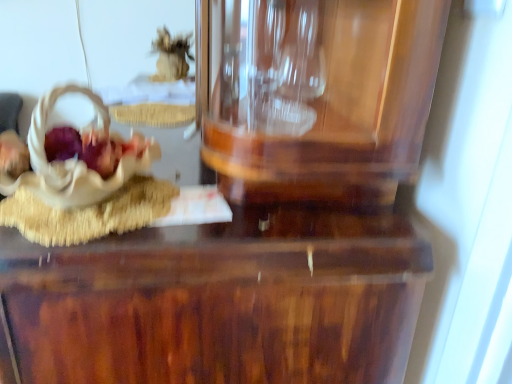
Find the location of a particular element. This screenshot has height=384, width=512. glossy wood table at center is located at coordinates (217, 302).

Describe the element at coordinates (170, 56) in the screenshot. I see `fuzzy brown object at upper center, the second stuff viewed from the front` at that location.

Find the location of a particular element. This screenshot has width=512, height=384. glossy wood table at center is located at coordinates (217, 302).

Looking at this image, can fuzzy brown object at upper center, the first stuff positioned from the back, be found inside beige fabric basket at left, the 1th stuff when ordered from bottom to top?

Definitely not — fuzzy brown object at upper center, the first stuff positioned from the back, is not inside beige fabric basket at left, the 1th stuff when ordered from bottom to top.

Can you tell me how much beige fabric basket at left, the 1th stuff positioned from the front, and fuzzy brown object at upper center, the first stuff positioned from the back, differ in facing direction?

1.26 degrees.

Is beige fabric basket at left, the 1th stuff positioned from the front, to the left of fuzzy brown object at upper center, which is the 1th stuff in top-to-bottom order, from the viewer's perspective?

In fact, beige fabric basket at left, the 1th stuff positioned from the front, is to the right of fuzzy brown object at upper center, which is the 1th stuff in top-to-bottom order.

Is beige fabric basket at left, the 1th stuff positioned from the front, beside fuzzy brown object at upper center, the second stuff viewed from the front?

No.

Is matte brown basket at left surrounded by fuzzy brown object at upper center, the first stuff positioned from the back?

No, fuzzy brown object at upper center, the first stuff positioned from the back, does not contain matte brown basket at left.

From a real-world perspective, relative to matte brown basket at left, is fuzzy brown object at upper center, which is the 1th stuff in top-to-bottom order, vertically above or below?

fuzzy brown object at upper center, which is the 1th stuff in top-to-bottom order, is above matte brown basket at left.

Is fuzzy brown object at upper center, which is the 1th stuff in top-to-bottom order, placed right next to matte brown basket at left?

There is a gap between fuzzy brown object at upper center, which is the 1th stuff in top-to-bottom order, and matte brown basket at left.

Looking at this image, is the position of matte brown basket at left less distant than that of glossy wood table at center?

No, matte brown basket at left is further to the viewer.

From a real-world perspective, is matte brown basket at left on top of glossy wood table at center?

Yes.

Between matte brown basket at left and glossy wood table at center, which one has more height?

Standing taller between the two is glossy wood table at center.

Between point (173, 68) and point (42, 109), which one is positioned behind?

Point (42, 109)

Which is correct: fuzzy brown object at upper center, which is the 1th stuff in top-to-bottom order, is inside beige fabric basket at left, the 1th stuff when ordered from bottom to top, or outside of it?

fuzzy brown object at upper center, which is the 1th stuff in top-to-bottom order, cannot be found inside beige fabric basket at left, the 1th stuff when ordered from bottom to top.

Which is more to the right, fuzzy brown object at upper center, which is the 2th stuff in bottom-to-top order, or beige fabric basket at left, the 1th stuff when ordered from bottom to top?

Positioned to the right is beige fabric basket at left, the 1th stuff when ordered from bottom to top.

From a real-world perspective, between glossy wood table at center and beige fabric basket at left, marked as the second stuff in a back-to-front arrangement, who is vertically higher?

From a 3D spatial view, beige fabric basket at left, marked as the second stuff in a back-to-front arrangement, is above.

Is glossy wood table at center in front of or behind beige fabric basket at left, the second stuff positioned from the top, in the image?

In the image, glossy wood table at center appears in front of beige fabric basket at left, the second stuff positioned from the top.

From the picture: Does glossy wood table at center turn towards beige fabric basket at left, the 1th stuff when ordered from bottom to top?

No, glossy wood table at center does not turn towards beige fabric basket at left, the 1th stuff when ordered from bottom to top.

Is glossy wood table at center far from beige fabric basket at left, marked as the second stuff in a back-to-front arrangement?

glossy wood table at center is near beige fabric basket at left, marked as the second stuff in a back-to-front arrangement, not far away.

Can you confirm if glossy wood table at center is shorter than matte brown basket at left?

No.

Are glossy wood table at center and matte brown basket at left located far from each other?

Actually, glossy wood table at center and matte brown basket at left are a little close together.

Locate an element on the screen. This screenshot has width=512, height=384. food above the glossy wood table at center (from a real-world perspective) is located at coordinates (89, 213).

Looking at this image, is the depth of glossy wood table at center greater than that of fuzzy brown object at upper center, which is the 1th stuff in top-to-bottom order?

No, it is in front of fuzzy brown object at upper center, which is the 1th stuff in top-to-bottom order.

How many degrees apart are the facing directions of glossy wood table at center and fuzzy brown object at upper center, which is the 2th stuff in bottom-to-top order?

2.51 degrees separate the facing orientations of glossy wood table at center and fuzzy brown object at upper center, which is the 2th stuff in bottom-to-top order.

Is glossy wood table at center not close to fuzzy brown object at upper center, the first stuff positioned from the back?

Yes, glossy wood table at center and fuzzy brown object at upper center, the first stuff positioned from the back, are located far from each other.

Identify the location of table lying on the right of fuzzy brown object at upper center, which is the 2th stuff in bottom-to-top order. This screenshot has height=384, width=512. (217, 302).

The image size is (512, 384). Find the location of `stuff that is above the beige fabric basket at left, the 1th stuff when ordered from bottom to top (from the image's perspective)`. stuff that is above the beige fabric basket at left, the 1th stuff when ordered from bottom to top (from the image's perspective) is located at coordinates (170, 56).

The height and width of the screenshot is (384, 512). Find the location of `food on the right of fuzzy brown object at upper center, which is the 1th stuff in top-to-bottom order`. food on the right of fuzzy brown object at upper center, which is the 1th stuff in top-to-bottom order is located at coordinates pyautogui.click(x=89, y=213).

Which object lies nearer to the anchor point fuzzy brown object at upper center, the second stuff viewed from the front, glossy wood table at center or beige fabric basket at left, the 1th stuff positioned from the front?

Based on the image, beige fabric basket at left, the 1th stuff positioned from the front, appears to be nearer to fuzzy brown object at upper center, the second stuff viewed from the front.

Which object lies further to the anchor point fuzzy brown object at upper center, the second stuff viewed from the front, matte brown basket at left or beige fabric basket at left, the 1th stuff when ordered from bottom to top?

matte brown basket at left is further to fuzzy brown object at upper center, the second stuff viewed from the front.

In the scene shown: Which object lies nearer to the anchor point beige fabric basket at left, the second stuff positioned from the top, fuzzy brown object at upper center, which is the 1th stuff in top-to-bottom order, or matte brown basket at left?

matte brown basket at left lies closer to beige fabric basket at left, the second stuff positioned from the top, than the other object.

Considering their positions, is glossy wood table at center positioned closer to matte brown basket at left than fuzzy brown object at upper center, which is the 1th stuff in top-to-bottom order?

Among the two, glossy wood table at center is located nearer to matte brown basket at left.

Based on their spatial positions, is beige fabric basket at left, the second stuff positioned from the top, or matte brown basket at left closer to glossy wood table at center?

matte brown basket at left lies closer to glossy wood table at center than the other object.

From the image, which object appears to be nearer to matte brown basket at left, fuzzy brown object at upper center, which is the 1th stuff in top-to-bottom order, or glossy wood table at center?

Among the two, glossy wood table at center is located nearer to matte brown basket at left.

Estimate the real-world distances between objects in this image. Which object is closer to beige fabric basket at left, the second stuff positioned from the top, matte brown basket at left or glossy wood table at center?

matte brown basket at left is closer to beige fabric basket at left, the second stuff positioned from the top.

Looking at the image, which one is located further to beige fabric basket at left, the 1th stuff positioned from the front, glossy wood table at center or matte brown basket at left?

glossy wood table at center.

What are the coordinates of `food located between beige fabric basket at left, marked as the second stuff in a back-to-front arrangement, and fuzzy brown object at upper center, which is the 1th stuff in top-to-bottom order, in the depth direction` in the screenshot? It's located at (89, 213).

You are a GUI agent. You are given a task and a screenshot of the screen. Output one action in this format:
    pyautogui.click(x=<x>, y=<y>)
    Task: Click on the food between glossy wood table at center and fuzzy brown object at upper center, which is the 1th stuff in top-to-bottom order, from front to back
    The image size is (512, 384).
    Given the screenshot: What is the action you would take?
    pyautogui.click(x=89, y=213)

You are a GUI agent. You are given a task and a screenshot of the screen. Output one action in this format:
    pyautogui.click(x=<x>, y=<y>)
    Task: Click on the food between beige fabric basket at left, marked as the second stuff in a back-to-front arrangement, and glossy wood table at center vertically
    The width and height of the screenshot is (512, 384).
    Given the screenshot: What is the action you would take?
    pyautogui.click(x=89, y=213)

In order to click on stuff between glossy wood table at center and fuzzy brown object at upper center, which is the 2th stuff in bottom-to-top order, along the z-axis in this screenshot , I will do `click(72, 161)`.